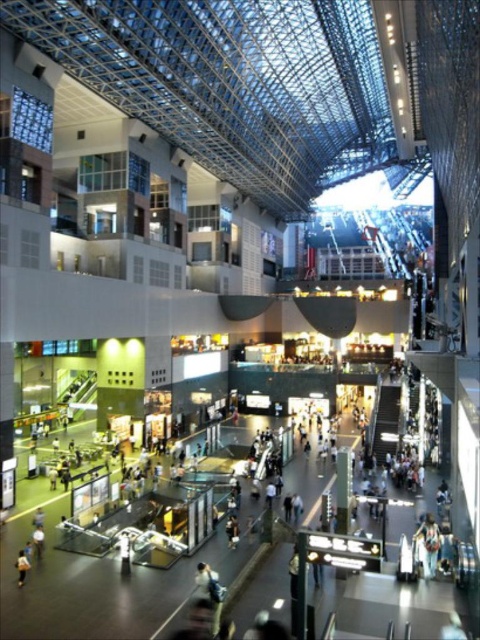
Which is more to the right, floral fabric dress at center or light brown leather jacket at lower left?

Positioned to the right is floral fabric dress at center.

From the picture: Can you confirm if floral fabric dress at center is smaller than light brown leather jacket at lower left?

No.

The height and width of the screenshot is (640, 480). I want to click on floral fabric dress at center, so click(x=428, y=545).

Looking at this image, how distant is floral fabric dress at center from white fabric person at center?

A distance of 93.82 feet exists between floral fabric dress at center and white fabric person at center.

Between floral fabric dress at center and white fabric person at center, which one has less height?

With less height is white fabric person at center.

Which is behind, point (416, 536) or point (128, 568)?

Positioned behind is point (416, 536).

You are a GUI agent. You are given a task and a screenshot of the screen. Output one action in this format:
    pyautogui.click(x=<x>, y=<y>)
    Task: Click on the floral fabric dress at center
    Image resolution: width=480 pixels, height=640 pixels.
    Given the screenshot: What is the action you would take?
    pyautogui.click(x=428, y=545)

Does white fabric person at center have a lesser height compared to light brown leather jacket at lower left?

Indeed, white fabric person at center has a lesser height compared to light brown leather jacket at lower left.

What do you see at coordinates (124, 554) in the screenshot?
I see `white fabric person at center` at bounding box center [124, 554].

Identify the location of white fabric person at center. (124, 554).